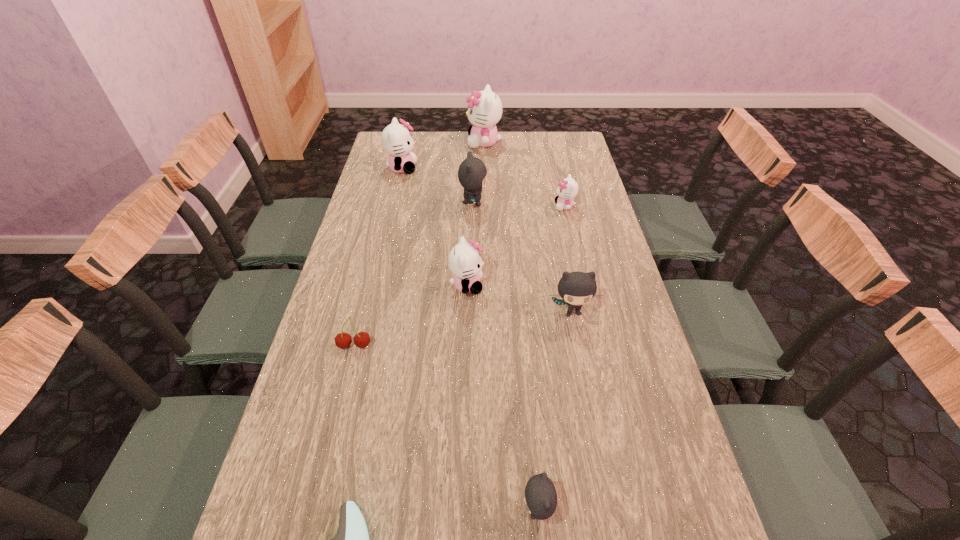
At what (x,y) coordinates should I click in order to perform the action: click on the third farthest white kitten. Please return your answer as a coordinate pair (x, y). This screenshot has height=540, width=960. Looking at the image, I should click on (567, 189).

Find the location of a particular element. the seventh farthest object is located at coordinates (362, 339).

Identify the location of vacant region located 0.220m on the front-facing side of the tallest object. This screenshot has height=540, width=960. (417, 142).

Find the location of a particular element. The image size is (960, 540). free region located 0.340m on the front-facing side of the tallest object is located at coordinates (389, 142).

Locate an element on the screen. The image size is (960, 540). vacant space located on the front-facing side of the tallest object is located at coordinates (453, 142).

I want to click on vacant space located on the front-facing side of the second farthest white kitten, so click(x=463, y=168).

Where is `blank space located 0.050m on the front-facing side of the biggest gray kitten`? blank space located 0.050m on the front-facing side of the biggest gray kitten is located at coordinates (501, 203).

In order to click on free spot located on the front-facing side of the nearest white kitten in this screenshot , I will do `click(598, 285)`.

You are a GUI agent. You are given a task and a screenshot of the screen. Output one action in this format:
    pyautogui.click(x=<x>, y=<y>)
    Task: Click on the vacant area located 0.210m on the front-facing side of the second farthest gray kitten
    
    Given the screenshot: What is the action you would take?
    pyautogui.click(x=588, y=391)

Where is `free space located 0.340m on the front-facing side of the rightmost white kitten`? Image resolution: width=960 pixels, height=540 pixels. free space located 0.340m on the front-facing side of the rightmost white kitten is located at coordinates (460, 206).